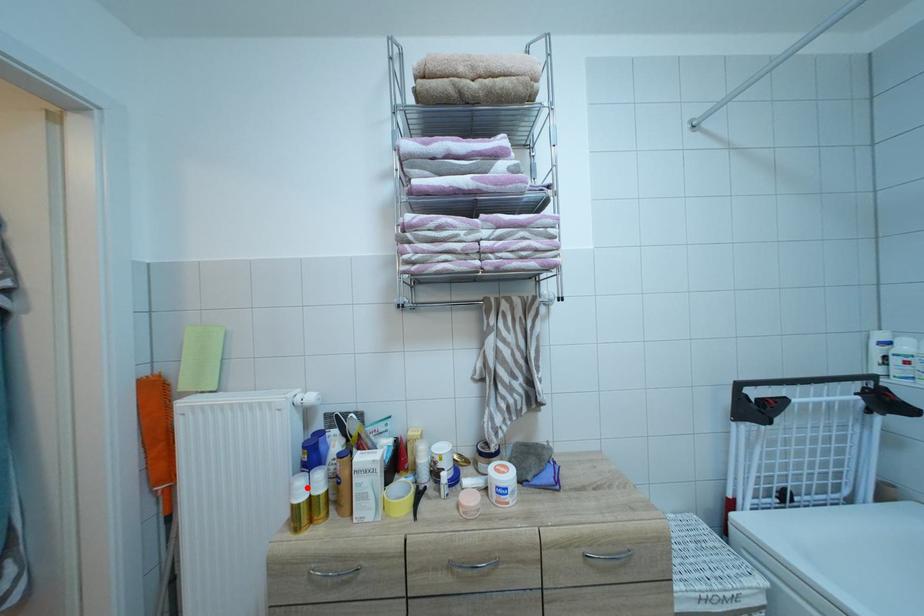
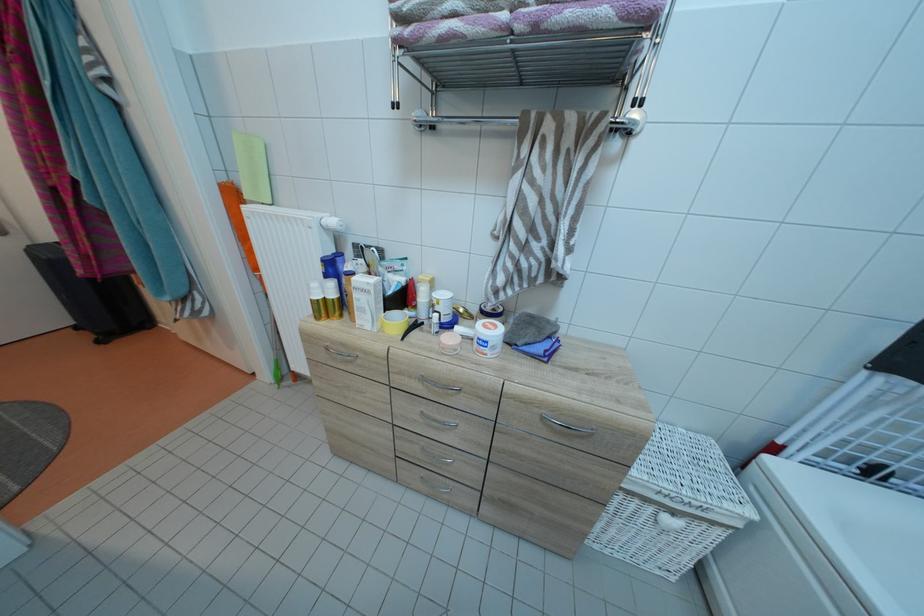
Locate, in the second image, the point that corresponds to the highlighted location in the first image.

(322, 291)